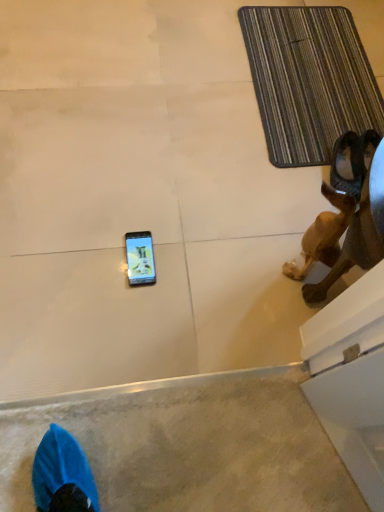
Question: Does brown leather dog at lower right appear on the right side of striped fabric bath mat at upper right?

Choices:
 (A) yes
 (B) no

Answer: (A)

Question: Considering the relative positions of brown leather dog at lower right and striped fabric bath mat at upper right in the image provided, is brown leather dog at lower right to the left of striped fabric bath mat at upper right from the viewer's perspective?

Choices:
 (A) yes
 (B) no

Answer: (B)

Question: Are brown leather dog at lower right and striped fabric bath mat at upper right far apart?

Choices:
 (A) yes
 (B) no

Answer: (B)

Question: Can you confirm if brown leather dog at lower right is thinner than striped fabric bath mat at upper right?

Choices:
 (A) no
 (B) yes

Answer: (B)

Question: From the image's perspective, is brown leather dog at lower right below striped fabric bath mat at upper right?

Choices:
 (A) no
 (B) yes

Answer: (B)

Question: Could you tell me if brown leather dog at lower right is facing striped fabric bath mat at upper right?

Choices:
 (A) yes
 (B) no

Answer: (A)

Question: Does striped fabric bath mat at upper right have a lesser width compared to brown leather dog at lower right?

Choices:
 (A) no
 (B) yes

Answer: (A)

Question: Does striped fabric bath mat at upper right have a lesser height compared to brown leather dog at lower right?

Choices:
 (A) no
 (B) yes

Answer: (B)

Question: Is striped fabric bath mat at upper right located outside brown leather dog at lower right?

Choices:
 (A) no
 (B) yes

Answer: (B)

Question: Does striped fabric bath mat at upper right turn towards brown leather dog at lower right?

Choices:
 (A) yes
 (B) no

Answer: (B)

Question: Considering the relative positions of striped fabric bath mat at upper right and brown leather dog at lower right in the image provided, is striped fabric bath mat at upper right to the left of brown leather dog at lower right from the viewer's perspective?

Choices:
 (A) no
 (B) yes

Answer: (B)

Question: Is striped fabric bath mat at upper right wider than brown leather dog at lower right?

Choices:
 (A) no
 (B) yes

Answer: (B)

Question: Considering the positions of point (339, 75) and point (377, 200), is point (339, 75) closer or farther from the camera than point (377, 200)?

Choices:
 (A) farther
 (B) closer

Answer: (A)